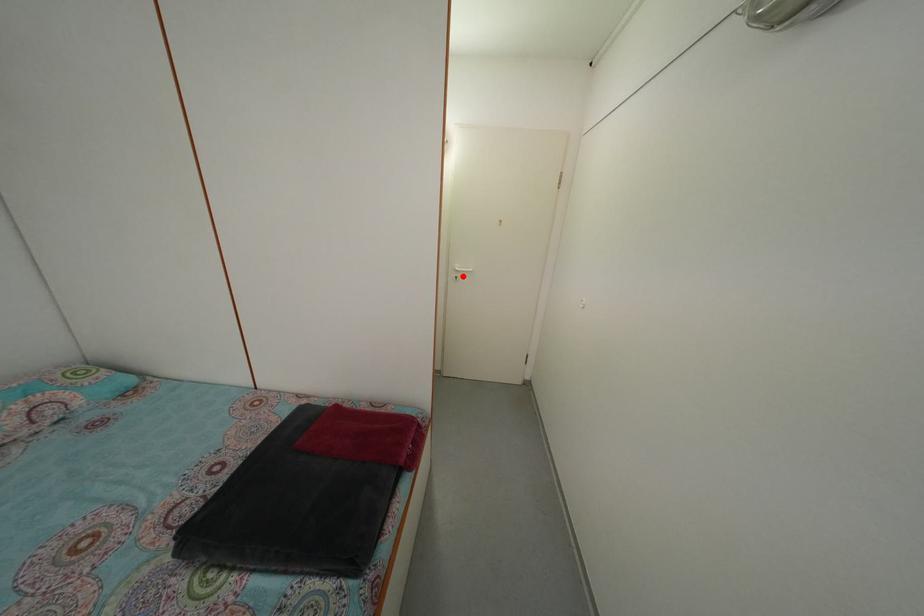
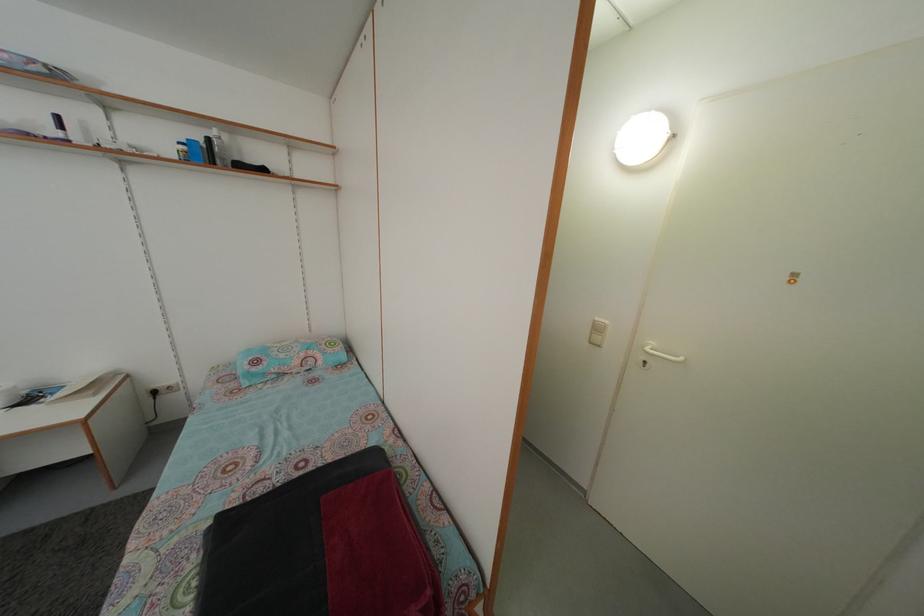
Locate, in the second image, the point that corresponds to the highlighted location in the first image.

(652, 355)